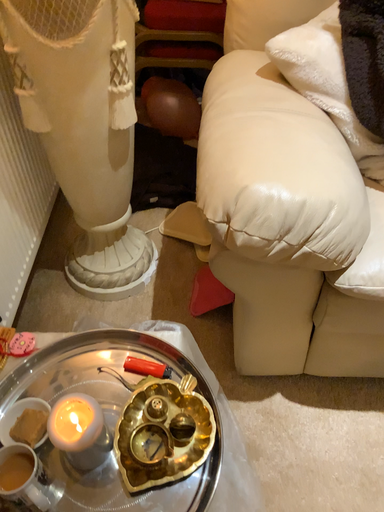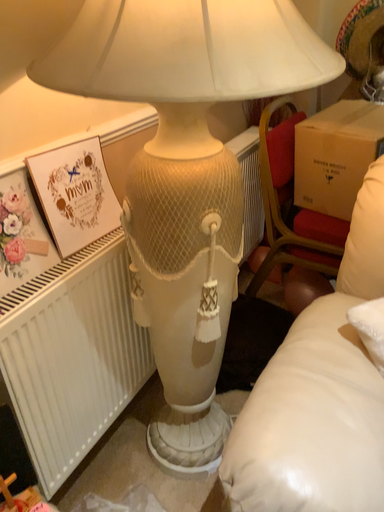
Question: Which way did the camera rotate in the video?

Choices:
 (A) rotated left
 (B) rotated right

Answer: (A)